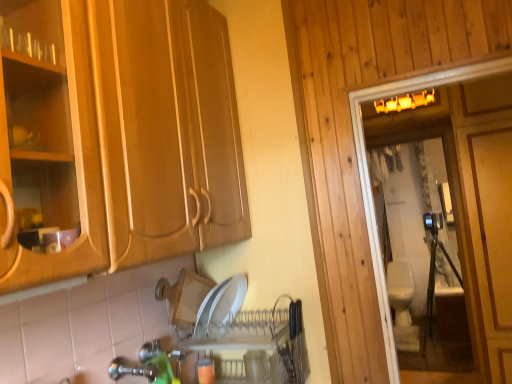
Question: Is white glossy toilet at right oriented away from beige ceramic toilet at right?

Choices:
 (A) yes
 (B) no

Answer: (B)

Question: Would you say white glossy toilet at right is outside beige ceramic toilet at right?

Choices:
 (A) no
 (B) yes

Answer: (B)

Question: Are white glossy toilet at right and beige ceramic toilet at right beside each other?

Choices:
 (A) no
 (B) yes

Answer: (A)

Question: Does white glossy toilet at right have a lesser height compared to beige ceramic toilet at right?

Choices:
 (A) no
 (B) yes

Answer: (A)

Question: Is there a large distance between white glossy toilet at right and beige ceramic toilet at right?

Choices:
 (A) no
 (B) yes

Answer: (B)

Question: Is white glossy toilet at right further to the viewer compared to beige ceramic toilet at right?

Choices:
 (A) yes
 (B) no

Answer: (B)

Question: From a real-world perspective, is beige ceramic toilet at right positioned over green plastic faucet at lower center based on gravity?

Choices:
 (A) no
 (B) yes

Answer: (A)

Question: Can you confirm if beige ceramic toilet at right is thinner than green plastic faucet at lower center?

Choices:
 (A) no
 (B) yes

Answer: (A)

Question: Is beige ceramic toilet at right closer to camera compared to green plastic faucet at lower center?

Choices:
 (A) no
 (B) yes

Answer: (A)

Question: From the image's perspective, is beige ceramic toilet at right over green plastic faucet at lower center?

Choices:
 (A) yes
 (B) no

Answer: (B)

Question: Is beige ceramic toilet at right turned away from green plastic faucet at lower center?

Choices:
 (A) yes
 (B) no

Answer: (B)

Question: From a real-world perspective, is beige ceramic toilet at right beneath green plastic faucet at lower center?

Choices:
 (A) no
 (B) yes

Answer: (B)

Question: Is white glossy toilet at right outside green plastic faucet at lower center?

Choices:
 (A) yes
 (B) no

Answer: (A)